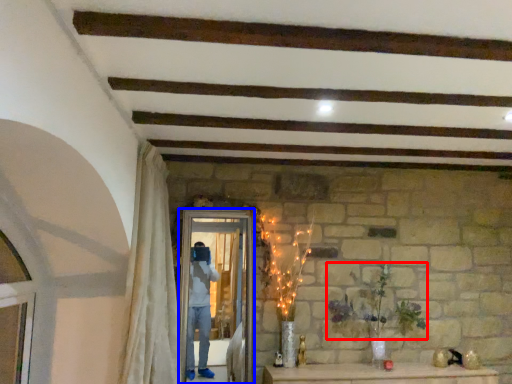
Question: Which of the following is the closest to the observer, plant (highlighted by a red box) or screen door (highlighted by a blue box)?

Choices:
 (A) plant
 (B) screen door

Answer: (B)